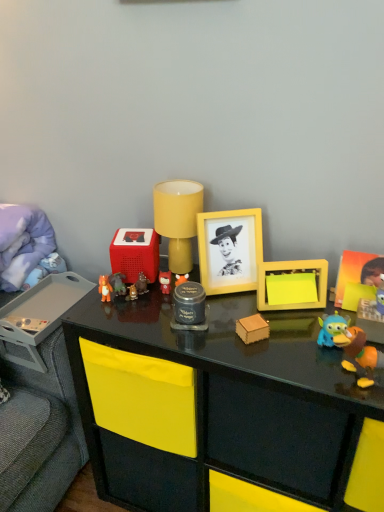
Question: In terms of width, does black glossy desk at center look wider or thinner when compared to matte black jar at center, the 5th toy viewed from the right?

Choices:
 (A) thin
 (B) wide

Answer: (B)

Question: Considering the positions of black glossy desk at center and matte black jar at center, the seventh toy viewed from the left, in the image, is black glossy desk at center bigger or smaller than matte black jar at center, the seventh toy viewed from the left,?

Choices:
 (A) small
 (B) big

Answer: (B)

Question: Which of these objects is positioned closest to the matte plastic toy at center, which is the sixth toy from left to right?

Choices:
 (A) yellow matte sticky notes at center-right, marked as the 3th toy in a right-to-left arrangement
 (B) yellow matte picture frame at upper right, the first picture frame from the right
 (C) wooden block at center, which is counted as the fourth toy, starting from the right
 (D) blue rubber duck at right, acting as the 2th toy starting from the right
 (E) yellow matte picture frame at center, acting as the first picture frame starting from the left

Answer: (E)

Question: Which is farther from the yellow matte sticky notes at center-right, marked as the ninth toy in a left-to-right arrangement?

Choices:
 (A) wooden block at center, which is the eighth toy in left-to-right order
 (B) black glossy desk at center
 (C) yellow matte picture frame at center, the second picture frame viewed from the right
 (D) matte plastic toy at center, placed as the 5th toy when sorted from left to right
 (E) yellow matte table lamp at center

Answer: (D)